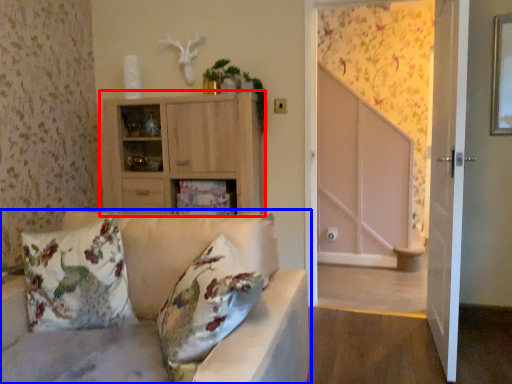
Question: Which object appears closest to the camera in this image, cabinetry (highlighted by a red box) or studio couch (highlighted by a blue box)?

Choices:
 (A) cabinetry
 (B) studio couch

Answer: (B)